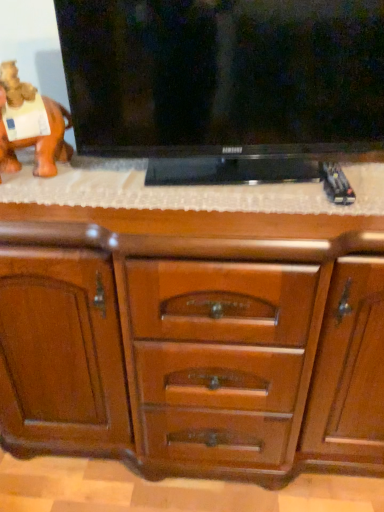
Describe the element at coordinates (193, 350) in the screenshot. I see `wooden chest of drawers at center` at that location.

This screenshot has height=512, width=384. Describe the element at coordinates (225, 83) in the screenshot. I see `black glossy flat-screen tv at upper center` at that location.

Locate an element on the screen. This screenshot has height=512, width=384. wooden chest of drawers at center is located at coordinates (193, 350).

Relative to orange matte elephant at left, is black glossy flat-screen tv at upper center in front or behind?

Visually, black glossy flat-screen tv at upper center is located in front of orange matte elephant at left.

Is black glossy flat-screen tv at upper center beside orange matte elephant at left?

No, black glossy flat-screen tv at upper center is not with orange matte elephant at left.

Which object is wider, black glossy flat-screen tv at upper center or orange matte elephant at left?

Wider between the two is black glossy flat-screen tv at upper center.

From the image's perspective, does black glossy flat-screen tv at upper center appear lower than orange matte elephant at left?

Incorrect, from the image's perspective, black glossy flat-screen tv at upper center is higher than orange matte elephant at left.

Is orange matte elephant at left thinner than wooden chest of drawers at center?

Correct, the width of orange matte elephant at left is less than that of wooden chest of drawers at center.

Is orange matte elephant at left positioned beyond the bounds of wooden chest of drawers at center?

Yes, orange matte elephant at left is located beyond the bounds of wooden chest of drawers at center.

How distant is orange matte elephant at left from wooden chest of drawers at center?

49.35 centimeters.

Considering the points (29, 120) and (255, 370), which point is in front, point (29, 120) or point (255, 370)?

The point (29, 120) is closer.

Is black glossy flat-screen tv at upper center at the back of wooden chest of drawers at center?

No, wooden chest of drawers at center is not facing away from black glossy flat-screen tv at upper center.

Identify the location of television above the wooden chest of drawers at center (from the image's perspective). The height and width of the screenshot is (512, 384). (225, 83).

Can you confirm if wooden chest of drawers at center is shorter than black glossy flat-screen tv at upper center?

No.

From the image's perspective, is wooden chest of drawers at center positioned above or below black glossy flat-screen tv at upper center?

From the image's perspective, wooden chest of drawers at center appears below black glossy flat-screen tv at upper center.

From a real-world perspective, which object rests below the other?

wooden chest of drawers at center.

Is black glossy flat-screen tv at upper center next to wooden chest of drawers at center?

black glossy flat-screen tv at upper center and wooden chest of drawers at center are clearly separated.

Which object is thinner, black glossy flat-screen tv at upper center or wooden chest of drawers at center?

With smaller width is black glossy flat-screen tv at upper center.

Which is in front, point (135, 154) or point (209, 411)?

The point (135, 154) is closer to the camera.

Can you confirm if wooden chest of drawers at center is positioned to the left of orange matte elephant at left?

No, wooden chest of drawers at center is not to the left of orange matte elephant at left.

Measure the distance between wooden chest of drawers at center and orange matte elephant at left.

19.43 inches.

Is wooden chest of drawers at center oriented away from orange matte elephant at left?

No, wooden chest of drawers at center is not facing away from orange matte elephant at left.

From the image's perspective, which is below, wooden chest of drawers at center or orange matte elephant at left?

wooden chest of drawers at center, from the image's perspective.

Is point (45, 139) positioned behind point (339, 50)?

Yes, it is.

In the image, is orange matte elephant at left positioned in front of or behind black glossy flat-screen tv at upper center?

In the image, orange matte elephant at left appears behind black glossy flat-screen tv at upper center.

From the image's perspective, between orange matte elephant at left and black glossy flat-screen tv at upper center, who is located below?

orange matte elephant at left is shown below in the image.

Is black glossy flat-screen tv at upper center completely or partially inside orange matte elephant at left?

No, black glossy flat-screen tv at upper center is not a part of orange matte elephant at left.

Identify the location of animal on the left side of black glossy flat-screen tv at upper center. (30, 125).

Where is `animal located above the wooden chest of drawers at center (from the image's perspective)`? This screenshot has width=384, height=512. animal located above the wooden chest of drawers at center (from the image's perspective) is located at coordinates (30, 125).

From the image, which object appears to be farther from wooden chest of drawers at center, orange matte elephant at left or black glossy flat-screen tv at upper center?

orange matte elephant at left lies further to wooden chest of drawers at center than the other object.

Considering their positions, is wooden chest of drawers at center positioned further to orange matte elephant at left than black glossy flat-screen tv at upper center?

Based on the image, wooden chest of drawers at center appears to be further to orange matte elephant at left.

From the image, which object appears to be farther from black glossy flat-screen tv at upper center, orange matte elephant at left or wooden chest of drawers at center?

Among the two, orange matte elephant at left is located further to black glossy flat-screen tv at upper center.

Considering their positions, is wooden chest of drawers at center positioned closer to black glossy flat-screen tv at upper center than orange matte elephant at left?

The object closer to black glossy flat-screen tv at upper center is wooden chest of drawers at center.

When comparing their distances from orange matte elephant at left, does black glossy flat-screen tv at upper center or wooden chest of drawers at center seem closer?

black glossy flat-screen tv at upper center.

Estimate the real-world distances between objects in this image. Which object is closer to wooden chest of drawers at center, black glossy flat-screen tv at upper center or orange matte elephant at left?

black glossy flat-screen tv at upper center is positioned closer to the anchor wooden chest of drawers at center.

You are a GUI agent. You are given a task and a screenshot of the screen. Output one action in this format:
    pyautogui.click(x=<x>, y=<y>)
    Task: Click on the animal between black glossy flat-screen tv at upper center and wooden chest of drawers at center vertically
    
    Given the screenshot: What is the action you would take?
    pyautogui.click(x=30, y=125)